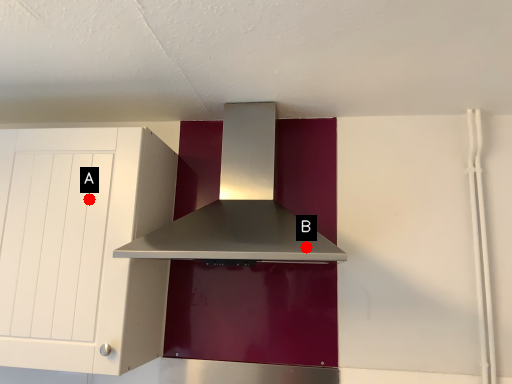
Question: Two points are circled on the image, labeled by A and B beside each circle. Which point is farther to the camera?

Choices:
 (A) A is further
 (B) B is further

Answer: (B)